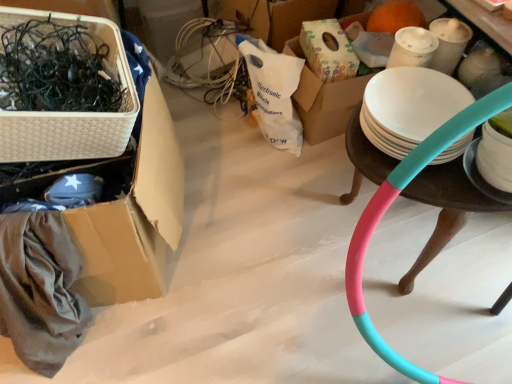
Question: Is white wicker basket at upper left facing away from teal matte hula hoop at right?

Choices:
 (A) no
 (B) yes

Answer: (A)

Question: Is white wicker basket at upper left at the left side of teal matte hula hoop at right?

Choices:
 (A) yes
 (B) no

Answer: (A)

Question: Is white wicker basket at upper left wider than teal matte hula hoop at right?

Choices:
 (A) yes
 (B) no

Answer: (B)

Question: Can we say white wicker basket at upper left lies outside teal matte hula hoop at right?

Choices:
 (A) no
 (B) yes

Answer: (B)

Question: Considering the relative positions of white wicker basket at upper left and teal matte hula hoop at right in the image provided, is white wicker basket at upper left to the right of teal matte hula hoop at right from the viewer's perspective?

Choices:
 (A) yes
 (B) no

Answer: (B)

Question: Is white wicker basket at upper left bigger or smaller than white wicker basket at left?

Choices:
 (A) big
 (B) small

Answer: (B)

Question: From the image's perspective, is white wicker basket at upper left located above or below white wicker basket at left?

Choices:
 (A) below
 (B) above

Answer: (B)

Question: Do you think white wicker basket at upper left is within white wicker basket at left, or outside of it?

Choices:
 (A) inside
 (B) outside

Answer: (B)

Question: Relative to white wicker basket at left, is white wicker basket at upper left in front or behind?

Choices:
 (A) behind
 (B) front

Answer: (B)

Question: Considering the positions of teal matte hula hoop at right and white wicker basket at left in the image, is teal matte hula hoop at right wider or thinner than white wicker basket at left?

Choices:
 (A) wide
 (B) thin

Answer: (B)

Question: Considering the relative positions of teal matte hula hoop at right and white wicker basket at left in the image provided, is teal matte hula hoop at right to the left or to the right of white wicker basket at left?

Choices:
 (A) right
 (B) left

Answer: (A)

Question: From a real-world perspective, is teal matte hula hoop at right positioned above or below white wicker basket at left?

Choices:
 (A) above
 (B) below

Answer: (B)

Question: Considering their positions, is teal matte hula hoop at right located in front of or behind white wicker basket at left?

Choices:
 (A) front
 (B) behind

Answer: (B)

Question: Do you think white matte plate at right is within white wicker basket at upper left, or outside of it?

Choices:
 (A) outside
 (B) inside

Answer: (A)

Question: Is white matte plate at right in front of or behind white wicker basket at upper left in the image?

Choices:
 (A) behind
 (B) front

Answer: (A)